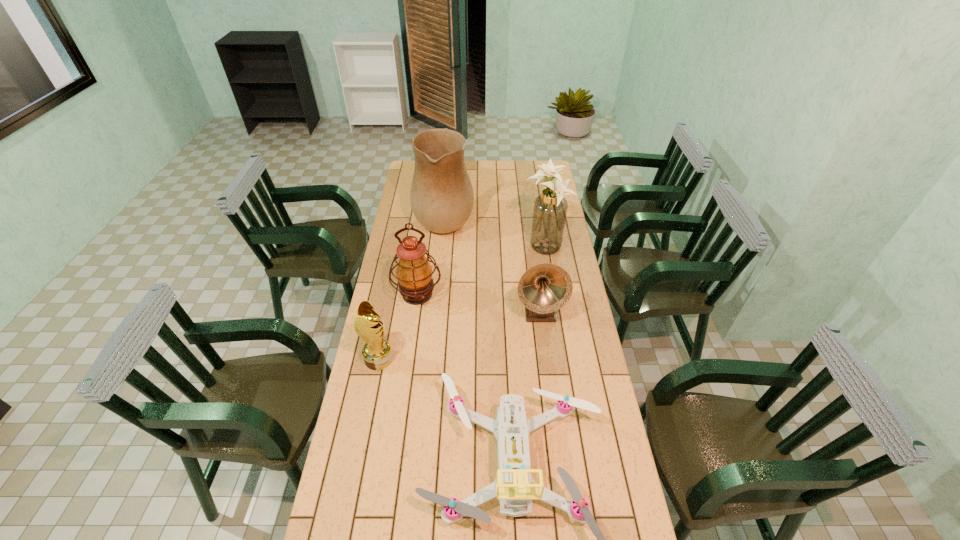
I want to click on cream pitcher, so click(441, 196).

The image size is (960, 540). Find the location of `flower arrangement`. flower arrangement is located at coordinates (550, 208).

This screenshot has height=540, width=960. What are the coordinates of `oil lamp` in the screenshot? It's located at (414, 273).

Find the location of a particular element. The width and height of the screenshot is (960, 540). phonograph record is located at coordinates (543, 289).

Find the location of a particular element. This screenshot has width=960, height=540. the fifth farthest object is located at coordinates (377, 353).

Locate an element on the screen. vacant position located 0.100m at the spout of the cream pitcher is located at coordinates (493, 217).

Locate an element on the screen. This screenshot has width=960, height=540. vacant area located on the left of the flower arrangement is located at coordinates (449, 248).

Find the location of a particular element. free space located 0.240m on the back of the oil lamp is located at coordinates (424, 243).

Identify the location of vacant point located 0.090m on the horn of the phonograph record. This screenshot has width=960, height=540. (544, 346).

What are the coordinates of `blank space located 0.050m on the front-facing side of the award` in the screenshot? It's located at (406, 359).